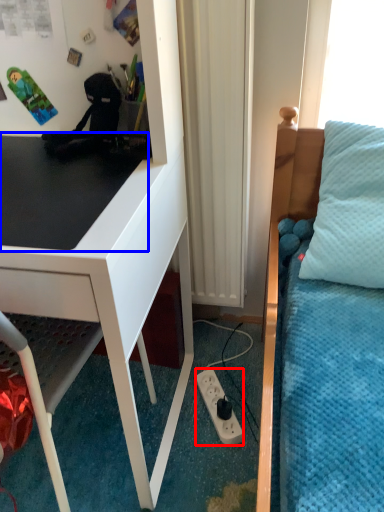
Question: Among these objects, which one is nearest to the camera, power outlet (highlighted by a red box) or table top (highlighted by a blue box)?

Choices:
 (A) power outlet
 (B) table top

Answer: (B)